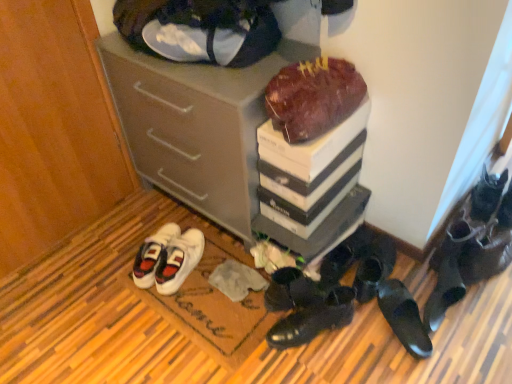
Question: Can you confirm if shiny black shoes at lower right, which is the 5th footwear from right to left, is positioned to the left of black leather shoe at lower right, acting as the 9th footwear starting from the left?

Choices:
 (A) no
 (B) yes

Answer: (B)

Question: Does shiny black shoes at lower right, which ranks as the 5th footwear in left-to-right order, have a greater height compared to black leather shoe at lower right, acting as the 9th footwear starting from the left?

Choices:
 (A) no
 (B) yes

Answer: (A)

Question: Is shiny black shoes at lower right, which ranks as the 5th footwear in left-to-right order, positioned before black leather shoe at lower right, acting as the 9th footwear starting from the left?

Choices:
 (A) yes
 (B) no

Answer: (A)

Question: Considering the relative sizes of shiny black shoes at lower right, which ranks as the 5th footwear in left-to-right order, and black leather shoe at lower right, acting as the 9th footwear starting from the left, in the image provided, is shiny black shoes at lower right, which ranks as the 5th footwear in left-to-right order, bigger than black leather shoe at lower right, acting as the 9th footwear starting from the left,?

Choices:
 (A) no
 (B) yes

Answer: (A)

Question: Is shiny black shoes at lower right, which is the 5th footwear from right to left, smaller than black leather shoe at lower right, acting as the 9th footwear starting from the left?

Choices:
 (A) no
 (B) yes

Answer: (B)

Question: From the image's perspective, would you say shiny black shoes at lower right, which ranks as the 5th footwear in left-to-right order, is positioned over black leather shoe at lower right, the first footwear from the right?

Choices:
 (A) yes
 (B) no

Answer: (B)

Question: Does black leather shoes at lower center, acting as the second footwear starting from the left, lie in front of black leather shoes at lower right, the 2th footwear when ordered from right to left?

Choices:
 (A) no
 (B) yes

Answer: (B)

Question: From a real-world perspective, is black leather shoes at lower center, placed as the 8th footwear when sorted from right to left, located beneath black leather shoes at lower right, placed as the 8th footwear when sorted from left to right?

Choices:
 (A) no
 (B) yes

Answer: (B)

Question: Is black leather shoes at lower center, acting as the second footwear starting from the left, further to camera compared to black leather shoes at lower right, placed as the 8th footwear when sorted from left to right?

Choices:
 (A) yes
 (B) no

Answer: (B)

Question: Considering the relative positions of black leather shoes at lower center, placed as the 8th footwear when sorted from right to left, and black leather shoes at lower right, placed as the 8th footwear when sorted from left to right, in the image provided, is black leather shoes at lower center, placed as the 8th footwear when sorted from right to left, to the left of black leather shoes at lower right, placed as the 8th footwear when sorted from left to right, from the viewer's perspective?

Choices:
 (A) no
 (B) yes

Answer: (B)

Question: Is black leather shoes at lower center, placed as the 8th footwear when sorted from right to left, outside of black leather shoes at lower right, the 2th footwear when ordered from right to left?

Choices:
 (A) no
 (B) yes

Answer: (B)

Question: Can you confirm if black leather shoes at lower center, placed as the 8th footwear when sorted from right to left, is taller than black leather shoes at lower right, the 2th footwear when ordered from right to left?

Choices:
 (A) no
 (B) yes

Answer: (A)

Question: From the image's perspective, is black leather shoes at lower right, which is the seventh footwear in right-to-left order, located above black leather shoes at lower right, the fourth footwear viewed from the left?

Choices:
 (A) yes
 (B) no

Answer: (B)